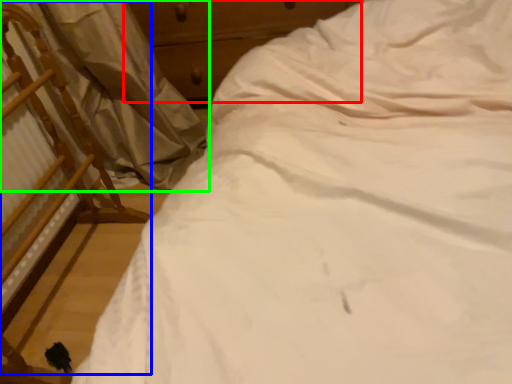
Question: Which object is the farthest from dresser (highlighted by a red box)? Choose among these: chair (highlighted by a blue box) or curtain (highlighted by a green box).

Choices:
 (A) chair
 (B) curtain

Answer: (A)